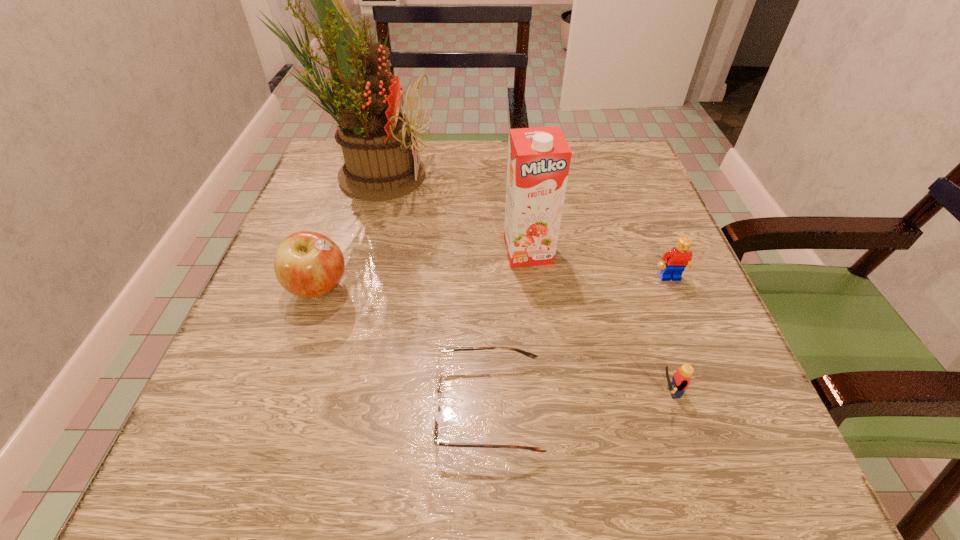
You are a GUI agent. You are given a task and a screenshot of the screen. Output one action in this format:
    pyautogui.click(x=<x>, y=<y>)
    Task: Click on the free space located on the back of the fifth shortest object
    This screenshot has height=540, width=960.
    Given the screenshot: What is the action you would take?
    pyautogui.click(x=523, y=212)

At what (x,y) coordinates should I click in order to perform the action: click on vacant area situated 0.200m on the right of the apple. Please return your answer as a coordinate pair (x, y). The width and height of the screenshot is (960, 540). Looking at the image, I should click on (462, 288).

At what (x,y) coordinates should I click in order to perform the action: click on vacant point located 0.320m on the front-facing side of the right Lego. Please return your answer as a coordinate pair (x, y). The height and width of the screenshot is (540, 960). Looking at the image, I should click on (745, 458).

I want to click on vacant position located 0.250m on the front-facing side of the nearer Lego, so [x=475, y=392].

Image resolution: width=960 pixels, height=540 pixels. I want to click on vacant point located 0.250m on the front-facing side of the nearer Lego, so click(x=475, y=392).

Find the location of a particular element. This screenshot has height=540, width=960. free spot located on the front-facing side of the nearer Lego is located at coordinates (414, 392).

The image size is (960, 540). I want to click on vacant region located 0.080m on the front-facing side of the spectacles, so click(x=378, y=408).

Find the location of a particular element. This screenshot has height=540, width=960. vacant space located on the front-facing side of the spectacles is located at coordinates (392, 408).

I want to click on free space located 0.210m on the front-facing side of the spectacles, so click(287, 408).

Where is `object that is at the far edge`? object that is at the far edge is located at coordinates (376, 138).